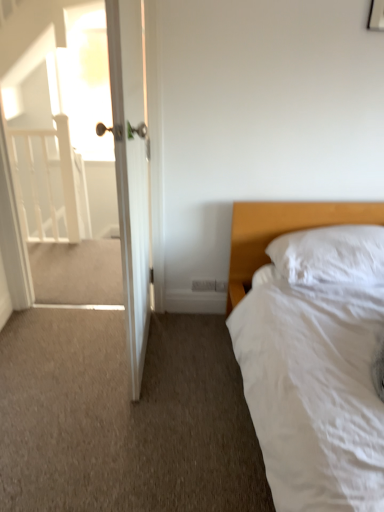
The height and width of the screenshot is (512, 384). Identify the location of vacant area that lies to the right of white wooden door at left. (188, 353).